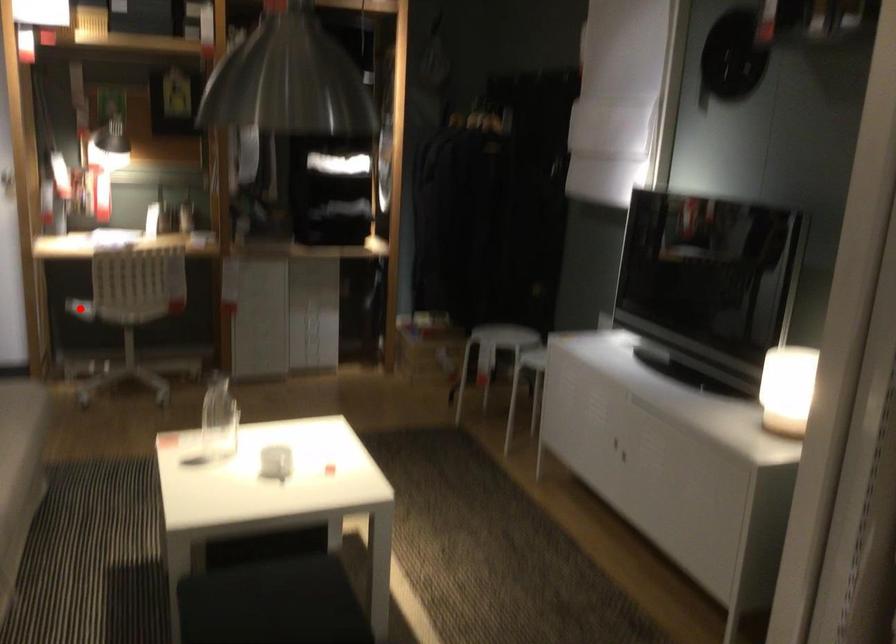
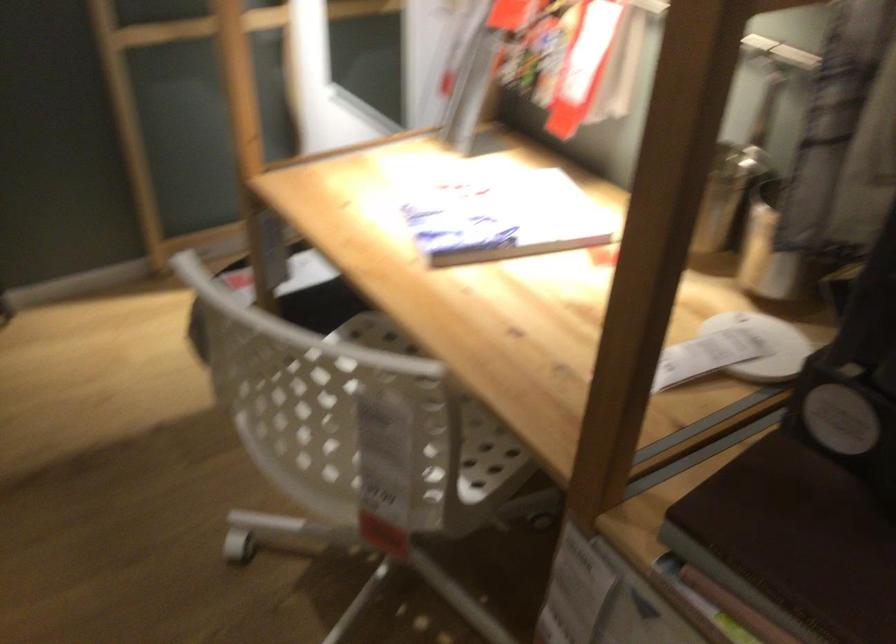
Question: I am providing you with two images of the same scene from different viewpoints. A red point is marked on the first image. Is the red point's position out of view in image 2?

Choices:
 (A) Yes
 (B) No

Answer: (A)